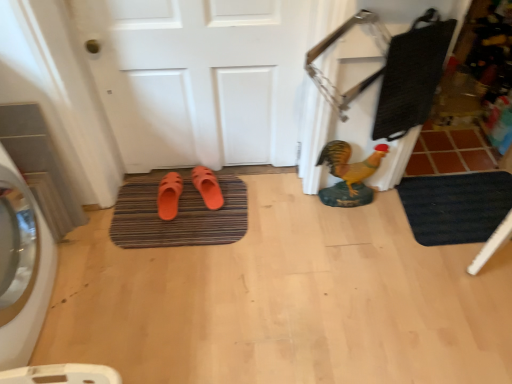
Question: Is orange rubber slipper at center, placed as the 1th footwear when sorted from right to left, not inside white matte door at center?

Choices:
 (A) no
 (B) yes

Answer: (B)

Question: Are orange rubber slipper at center, placed as the 1th footwear when sorted from right to left, and white matte door at center making contact?

Choices:
 (A) yes
 (B) no

Answer: (B)

Question: From a real-world perspective, is orange rubber slipper at center, placed as the 1th footwear when sorted from right to left, on top of white matte door at center?

Choices:
 (A) no
 (B) yes

Answer: (A)

Question: Does orange rubber slipper at center, placed as the 1th footwear when sorted from right to left, have a larger size compared to white matte door at center?

Choices:
 (A) no
 (B) yes

Answer: (A)

Question: Does orange rubber slipper at center, marked as the 2th footwear in a left-to-right arrangement, have a lesser width compared to white matte door at center?

Choices:
 (A) no
 (B) yes

Answer: (A)

Question: Can you confirm if orange rubber slipper at center, marked as the 2th footwear in a left-to-right arrangement, is wider than white matte door at center?

Choices:
 (A) no
 (B) yes

Answer: (B)

Question: Does brown textured bath mat at center, marked as the first bath mat in a left-to-right arrangement, have a greater height compared to white glossy washing machine at left?

Choices:
 (A) yes
 (B) no

Answer: (B)

Question: Is brown textured bath mat at center, the 2th bath mat from the right, positioned before white glossy washing machine at left?

Choices:
 (A) no
 (B) yes

Answer: (A)

Question: Considering the relative positions of brown textured bath mat at center, marked as the first bath mat in a left-to-right arrangement, and white glossy washing machine at left in the image provided, is brown textured bath mat at center, marked as the first bath mat in a left-to-right arrangement, behind white glossy washing machine at left?

Choices:
 (A) yes
 (B) no

Answer: (A)

Question: Can you confirm if brown textured bath mat at center, marked as the first bath mat in a left-to-right arrangement, is wider than white glossy washing machine at left?

Choices:
 (A) yes
 (B) no

Answer: (A)

Question: From the image's perspective, does brown textured bath mat at center, marked as the first bath mat in a left-to-right arrangement, appear higher than white glossy washing machine at left?

Choices:
 (A) no
 (B) yes

Answer: (B)

Question: Is brown textured bath mat at center, the 2th bath mat from the right, at the right side of white glossy washing machine at left?

Choices:
 (A) no
 (B) yes

Answer: (B)

Question: Does orange rubber slipper at center, marked as the 2th footwear in a left-to-right arrangement, lie in front of brown tile at right?

Choices:
 (A) yes
 (B) no

Answer: (A)